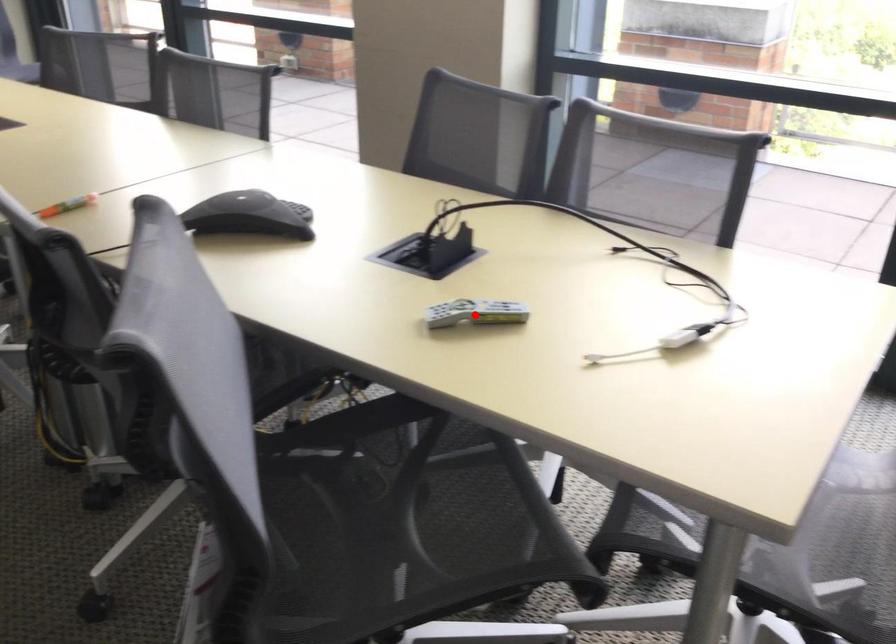
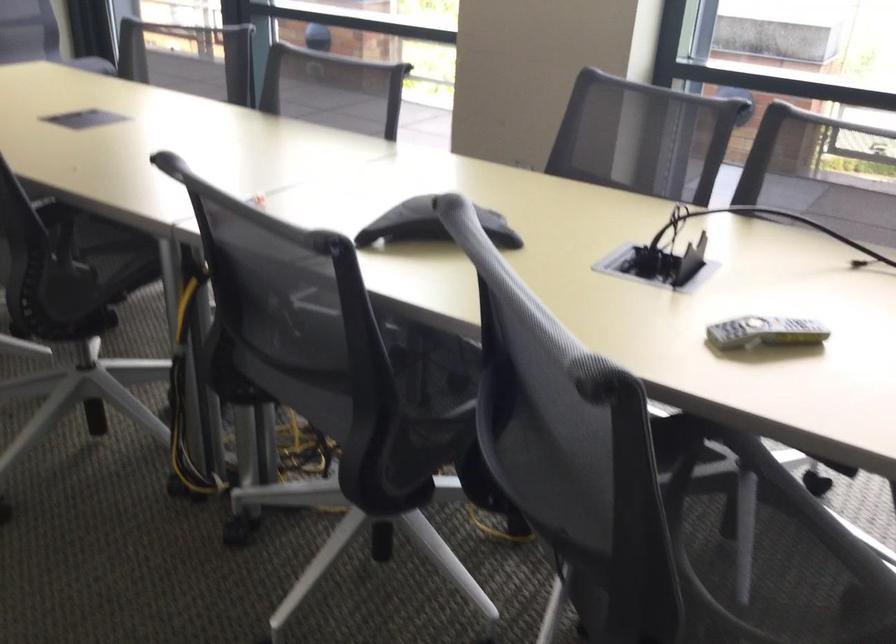
Question: I am providing you with two images of the same scene from different viewpoints. Image1 has a red point marked. In image2, the corresponding 3D location appears at what relative position? Reply with the corresponding letter.

Choices:
 (A) Closer
 (B) Farther

Answer: (A)